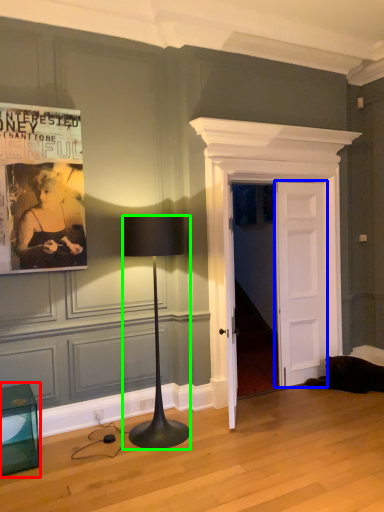
Question: Considering the real-world distances, which object is closest to furniture (highlighted by a red box)? door (highlighted by a blue box) or lamp (highlighted by a green box).

Choices:
 (A) door
 (B) lamp

Answer: (B)